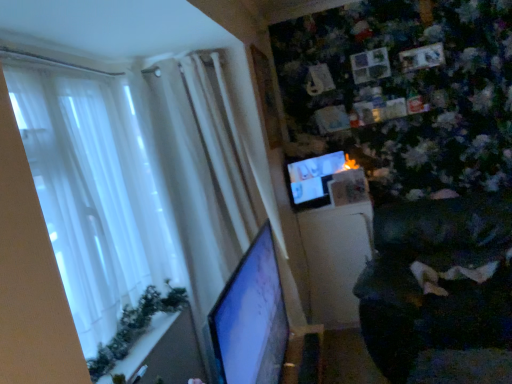
The image size is (512, 384). Describe the element at coordinates (313, 179) in the screenshot. I see `matte black monitor at center, the first computer monitor in the right-to-left sequence` at that location.

What are the coordinates of `matte black monitor at left, placed as the 2th computer monitor when sorted from back to front` in the screenshot? It's located at (250, 319).

Is matte black monitor at left, placed as the 2th computer monitor when sorted from back to front, with matte black monitor at center, positioned as the first computer monitor in back-to-front order?

No.

Is matte black monitor at left, the second computer monitor in the top-to-bottom sequence, in front of or behind matte black monitor at center, arranged as the 2th computer monitor when ordered from the bottom, in the image?

In the image, matte black monitor at left, the second computer monitor in the top-to-bottom sequence, appears in front of matte black monitor at center, arranged as the 2th computer monitor when ordered from the bottom.

Based on their positions, is matte black monitor at left, which is counted as the 1th computer monitor, starting from the bottom, located to the left or right of matte black monitor at center, positioned as the 1th computer monitor in top-to-bottom order?

From the image, it's evident that matte black monitor at left, which is counted as the 1th computer monitor, starting from the bottom, is to the left of matte black monitor at center, positioned as the 1th computer monitor in top-to-bottom order.

Considering the relative sizes of dark fabric swivel chair at lower right and matte black monitor at left, the first computer monitor from the left, in the image provided, is dark fabric swivel chair at lower right taller than matte black monitor at left, the first computer monitor from the left,?

Indeed, dark fabric swivel chair at lower right has a greater height compared to matte black monitor at left, the first computer monitor from the left.

Between dark fabric swivel chair at lower right and matte black monitor at left, the second computer monitor in the top-to-bottom sequence, which one appears on the right side from the viewer's perspective?

dark fabric swivel chair at lower right is more to the right.

Can you confirm if dark fabric swivel chair at lower right is wider than matte black monitor at left, placed as the 2th computer monitor when sorted from back to front?

Yes.

Measure the distance between dark fabric swivel chair at lower right and matte black monitor at left, the first computer monitor from the front.

The distance of dark fabric swivel chair at lower right from matte black monitor at left, the first computer monitor from the front, is 37.13 inches.

Does white sheer curtain at left have a greater height compared to matte black monitor at center, positioned as the 1th computer monitor in top-to-bottom order?

Yes.

Is white sheer curtain at left bigger than matte black monitor at center, positioned as the 1th computer monitor in top-to-bottom order?

Yes.

Can you tell me how much white sheer curtain at left and matte black monitor at center, positioned as the first computer monitor in back-to-front order, differ in facing direction?

They differ by 4.77 degrees in their facing directions.

Is white sheer curtain at left turned away from matte black monitor at center, marked as the second computer monitor in a left-to-right arrangement?

No, white sheer curtain at left's orientation is not away from matte black monitor at center, marked as the second computer monitor in a left-to-right arrangement.

From the image's perspective, is matte black monitor at center, positioned as the 1th computer monitor in top-to-bottom order, above or below matte black monitor at left, the first computer monitor from the left?

matte black monitor at center, positioned as the 1th computer monitor in top-to-bottom order, is situated higher than matte black monitor at left, the first computer monitor from the left, in the image.

Is matte black monitor at center, the first computer monitor in the right-to-left sequence, looking in the opposite direction of matte black monitor at left, which is counted as the 1th computer monitor, starting from the bottom?

matte black monitor at center, the first computer monitor in the right-to-left sequence, does not have its back to matte black monitor at left, which is counted as the 1th computer monitor, starting from the bottom.

The height and width of the screenshot is (384, 512). In the image, there is a matte black monitor at left, placed as the 2th computer monitor when sorted from back to front. Find the location of `computer monitor above it (from the image's perspective)`. computer monitor above it (from the image's perspective) is located at coordinates (313, 179).

Is dark fabric swivel chair at lower right inside the boundaries of matte black monitor at center, the second computer monitor in the front-to-back sequence, or outside?

The correct answer is: outside.

Considering the sizes of objects dark fabric swivel chair at lower right and matte black monitor at center, the second computer monitor in the front-to-back sequence, in the image provided, who is wider, dark fabric swivel chair at lower right or matte black monitor at center, the second computer monitor in the front-to-back sequence,?

With larger width is dark fabric swivel chair at lower right.

Looking at the image, does dark fabric swivel chair at lower right seem bigger or smaller compared to matte black monitor at center, positioned as the first computer monitor in back-to-front order?

Clearly, dark fabric swivel chair at lower right is larger in size than matte black monitor at center, positioned as the first computer monitor in back-to-front order.

In the scene shown: From the image's perspective, which object appears higher, dark fabric swivel chair at lower right or matte black monitor at center, positioned as the first computer monitor in back-to-front order?

matte black monitor at center, positioned as the first computer monitor in back-to-front order.

Considering the positions of objects matte black monitor at center, arranged as the 2th computer monitor when ordered from the bottom, and white sheer curtain at left in the image provided, who is more to the right, matte black monitor at center, arranged as the 2th computer monitor when ordered from the bottom, or white sheer curtain at left?

Positioned to the right is matte black monitor at center, arranged as the 2th computer monitor when ordered from the bottom.

Is matte black monitor at center, marked as the second computer monitor in a left-to-right arrangement, in front of white sheer curtain at left?

No, it is not.

From the image's perspective, is matte black monitor at center, the second computer monitor in the front-to-back sequence, beneath white sheer curtain at left?

Incorrect, from the image's perspective, matte black monitor at center, the second computer monitor in the front-to-back sequence, is higher than white sheer curtain at left.

Does point (305, 166) come in front of point (211, 96)?

No, it is behind (211, 96).

Looking at this image, which is more distant, (323, 174) or (476, 292)?

The point (323, 174) is behind.

Are matte black monitor at center, the first computer monitor in the right-to-left sequence, and dark fabric swivel chair at lower right making contact?

There is a gap between matte black monitor at center, the first computer monitor in the right-to-left sequence, and dark fabric swivel chair at lower right.

From the image's perspective, would you say matte black monitor at center, arranged as the 2th computer monitor when ordered from the bottom, is shown under dark fabric swivel chair at lower right?

No, from the image's perspective, matte black monitor at center, arranged as the 2th computer monitor when ordered from the bottom, is not beneath dark fabric swivel chair at lower right.

Is matte black monitor at center, the first computer monitor in the right-to-left sequence, positioned behind dark fabric swivel chair at lower right?

Yes, matte black monitor at center, the first computer monitor in the right-to-left sequence, is further from the camera.

The image size is (512, 384). Identify the location of computer monitor that is above the matte black monitor at left, the second computer monitor in the top-to-bottom sequence (from a real-world perspective). (313, 179).

The width and height of the screenshot is (512, 384). Identify the location of the 1st computer monitor above the dark fabric swivel chair at lower right (from the image's perspective). (250, 319).

When comparing their distances from white sheer curtain at left, does matte black monitor at left, the 2th computer monitor when ordered from right to left, or dark fabric swivel chair at lower right seem further?

dark fabric swivel chair at lower right is positioned further to the anchor white sheer curtain at left.

Looking at the image, which one is located closer to matte black monitor at left, the 2th computer monitor when ordered from right to left, white sheer curtain at left or matte black monitor at center, the second computer monitor in the front-to-back sequence?

white sheer curtain at left is positioned closer to the anchor matte black monitor at left, the 2th computer monitor when ordered from right to left.

Considering their positions, is matte black monitor at center, the second computer monitor in the front-to-back sequence, positioned further to dark fabric swivel chair at lower right than white sheer curtain at left?

white sheer curtain at left is positioned further to the anchor dark fabric swivel chair at lower right.

Looking at this image, considering their positions, is matte black monitor at center, arranged as the 2th computer monitor when ordered from the bottom, positioned closer to matte black monitor at left, which is counted as the 1th computer monitor, starting from the bottom, than dark fabric swivel chair at lower right?

Based on the image, dark fabric swivel chair at lower right appears to be nearer to matte black monitor at left, which is counted as the 1th computer monitor, starting from the bottom.

Estimate the real-world distances between objects in this image. Which object is further from matte black monitor at center, positioned as the first computer monitor in back-to-front order, white sheer curtain at left or matte black monitor at left, the first computer monitor from the left?

matte black monitor at left, the first computer monitor from the left, is further to matte black monitor at center, positioned as the first computer monitor in back-to-front order.

When comparing their distances from matte black monitor at left, the first computer monitor from the left, does dark fabric swivel chair at lower right or matte black monitor at center, the first computer monitor in the right-to-left sequence, seem closer?

dark fabric swivel chair at lower right is closer to matte black monitor at left, the first computer monitor from the left.

Which object lies nearer to the anchor point matte black monitor at center, the first computer monitor in the right-to-left sequence, dark fabric swivel chair at lower right or white sheer curtain at left?

Based on the image, white sheer curtain at left appears to be nearer to matte black monitor at center, the first computer monitor in the right-to-left sequence.

From the picture: Which object lies further to the anchor point matte black monitor at left, the 2th computer monitor when ordered from right to left, matte black monitor at center, the first computer monitor in the right-to-left sequence, or white sheer curtain at left?

matte black monitor at center, the first computer monitor in the right-to-left sequence, is further to matte black monitor at left, the 2th computer monitor when ordered from right to left.

This screenshot has width=512, height=384. Identify the location of curtain located between matte black monitor at left, the 2th computer monitor when ordered from right to left, and matte black monitor at center, positioned as the first computer monitor in back-to-front order, in the depth direction. (206, 169).

What are the coordinates of `swivel chair between matte black monitor at left, the 2th computer monitor when ordered from right to left, and matte black monitor at center, the second computer monitor in the front-to-back sequence, along the z-axis` in the screenshot? It's located at (437, 279).